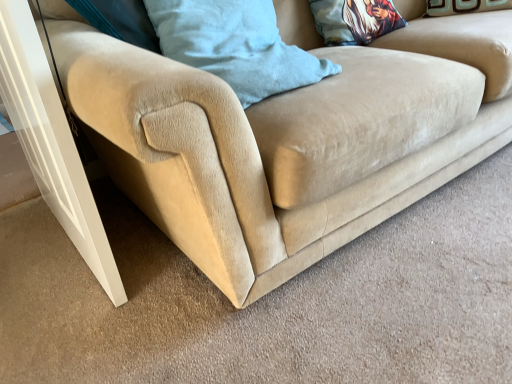
Find the location of a particular element. The height and width of the screenshot is (384, 512). free space that is to the left of white glossy screen door at lower left is located at coordinates [x=28, y=246].